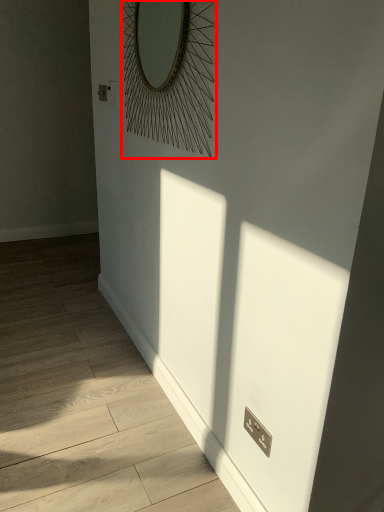
Question: From the image's perspective, what is the correct spatial relationship of mirror (annotated by the red box) in relation to corridor?

Choices:
 (A) above
 (B) below

Answer: (A)